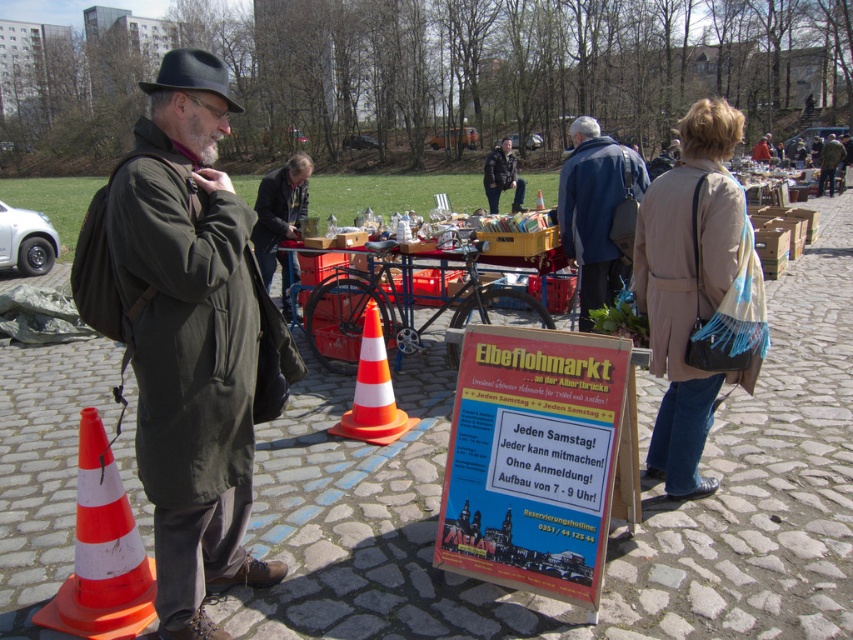
Does orange/white plastic traffic cone at center have a lesser width compared to dark brown leather jacket at center?

Yes, orange/white plastic traffic cone at center is thinner than dark brown leather jacket at center.

Locate an element on the screen. This screenshot has width=853, height=640. orange/white plastic traffic cone at center is located at coordinates (372, 392).

Is point (393, 436) positioned behind point (491, 192)?

No, (393, 436) is closer to viewer.

Locate an element on the screen. The width and height of the screenshot is (853, 640). orange/white plastic traffic cone at center is located at coordinates (372, 392).

Is point (108, 582) closer to viewer compared to point (364, 388)?

Yes, it is.

You are a GUI agent. You are given a task and a screenshot of the screen. Output one action in this format:
    pyautogui.click(x=<x>, y=<y>)
    Task: Click on the orange/white plastic traffic cone at lower left
    
    Given the screenshot: What is the action you would take?
    pyautogui.click(x=102, y=552)

Is dark olive-green coat at left further to camera compared to orange/white plastic traffic cone at lower left?

No, it is in front of orange/white plastic traffic cone at lower left.

Consider the image. Does dark olive-green coat at left have a lesser height compared to orange/white plastic traffic cone at lower left?

In fact, dark olive-green coat at left may be taller than orange/white plastic traffic cone at lower left.

Locate an element on the screen. The width and height of the screenshot is (853, 640). dark olive-green coat at left is located at coordinates (192, 339).